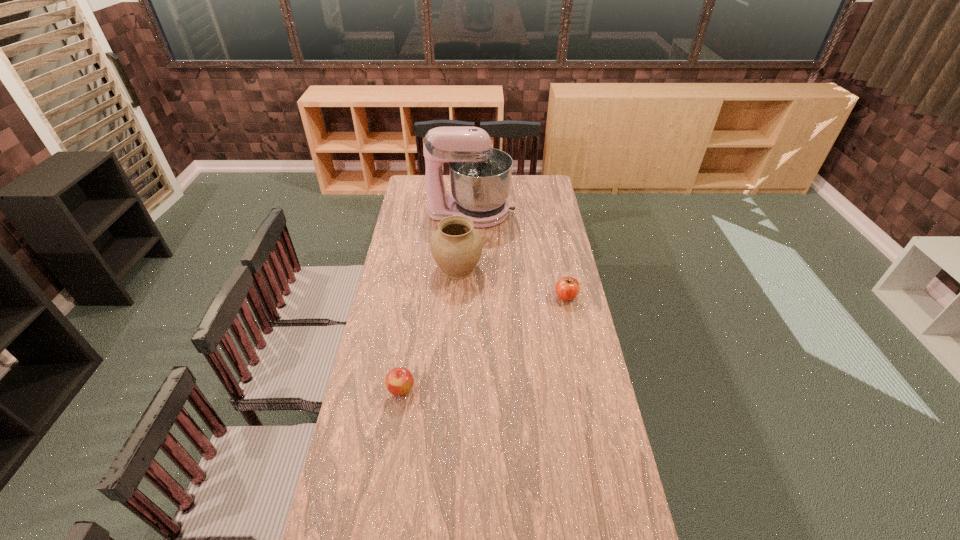
Image resolution: width=960 pixels, height=540 pixels. Identify the location of vacant space at the far right corner. (556, 195).

Where is `vacant area between the urn and the farther apple`? This screenshot has width=960, height=540. vacant area between the urn and the farther apple is located at coordinates (512, 282).

Find the location of a particular element. Image resolution: width=960 pixels, height=540 pixels. free space between the nearest object and the second farthest object is located at coordinates coord(429,328).

What are the coordinates of `blank region between the nearer apple and the farther apple` in the screenshot? It's located at (484, 342).

In order to click on free space between the nearest object and the second nearest object in this screenshot , I will do `click(484, 342)`.

Identify the location of empty space between the right apple and the nearest object. Image resolution: width=960 pixels, height=540 pixels. (484, 342).

This screenshot has height=540, width=960. Find the location of `vacant area that lies between the rightmost object and the tallest object`. vacant area that lies between the rightmost object and the tallest object is located at coordinates (518, 254).

Where is `free space between the right apple and the second farthest object`? Image resolution: width=960 pixels, height=540 pixels. free space between the right apple and the second farthest object is located at coordinates (512, 282).

Locate an element on the screen. This screenshot has height=540, width=960. free space between the tallest object and the rightmost object is located at coordinates (518, 254).

Where is `free space between the nearest object and the mixer`? free space between the nearest object and the mixer is located at coordinates (436, 301).